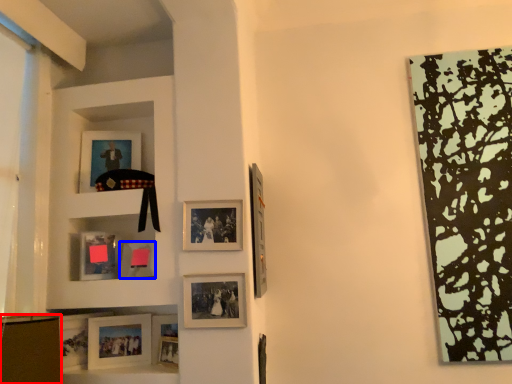
Question: Which point is closer to the camera, shelf (highlighted by a red box) or picture frame (highlighted by a blue box)?

Choices:
 (A) shelf
 (B) picture frame

Answer: (A)